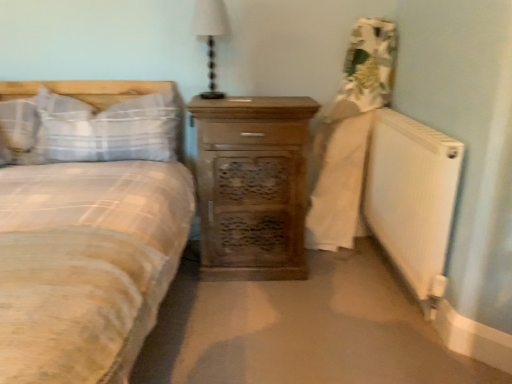
You are a GUI agent. You are given a task and a screenshot of the screen. Output one action in this format:
    pyautogui.click(x=<x>, y=<y>)
    Task: Click on the vacant area that is situated to the right of wooden chest of drawers at center
    The width and height of the screenshot is (512, 384).
    Given the screenshot: What is the action you would take?
    pyautogui.click(x=343, y=282)